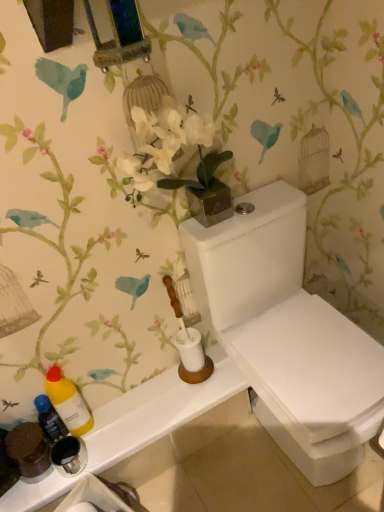
In order to click on vacant space in between white ceramic toilet brush at center and translucent plastic bottle at lower left, which is counted as the second bottle, starting from the right in this screenshot , I will do `click(149, 394)`.